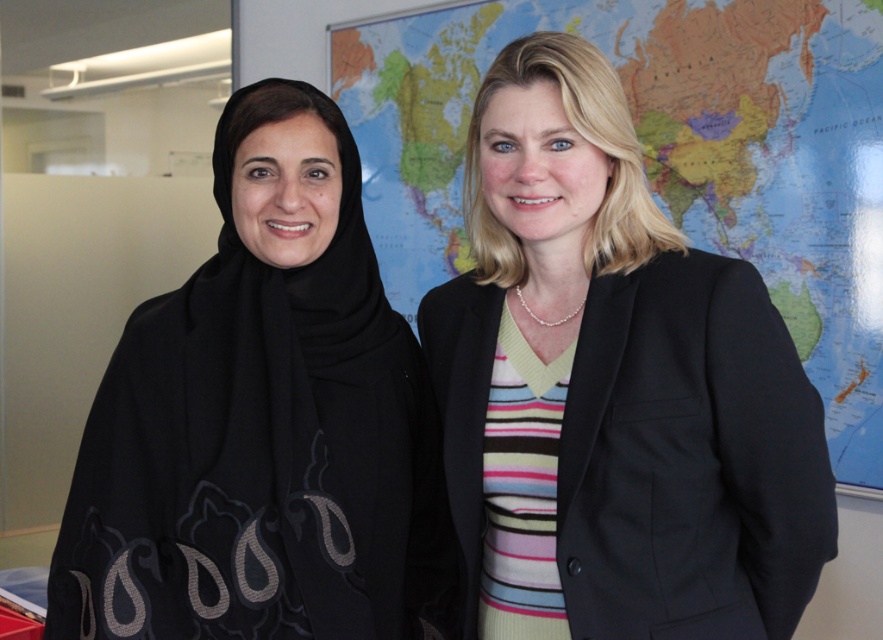
Question: Can you confirm if black matte scarf at left is positioned above map at center?

Choices:
 (A) yes
 (B) no

Answer: (B)

Question: Does black matte scarf at left appear on the left side of map at center?

Choices:
 (A) yes
 (B) no

Answer: (A)

Question: Which point is farther from the camera taking this photo?

Choices:
 (A) (793, 234)
 (B) (201, 604)

Answer: (A)

Question: Does black matte scarf at left lie in front of map at center?

Choices:
 (A) no
 (B) yes

Answer: (B)

Question: Which object is closer to the camera taking this photo?

Choices:
 (A) map at center
 (B) black matte scarf at left

Answer: (B)